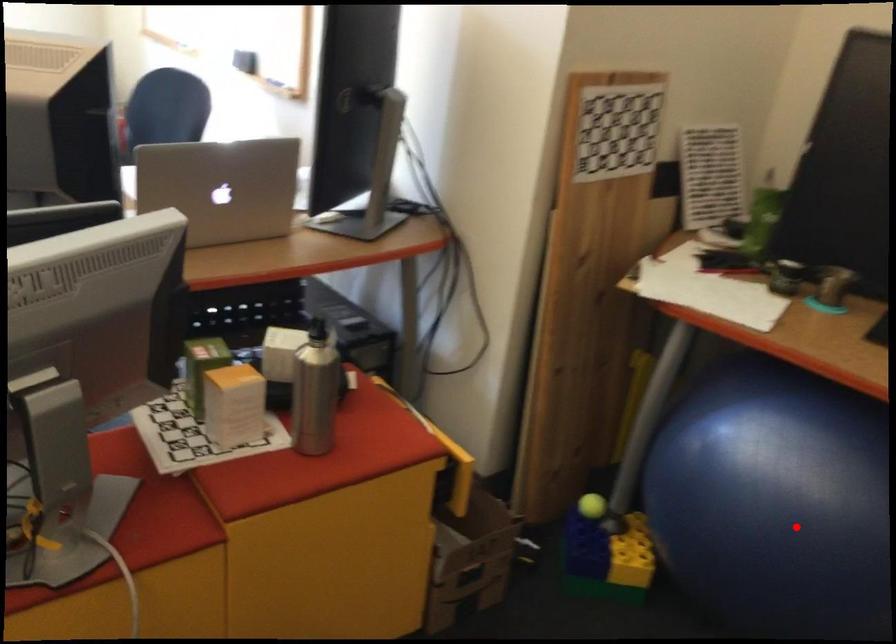
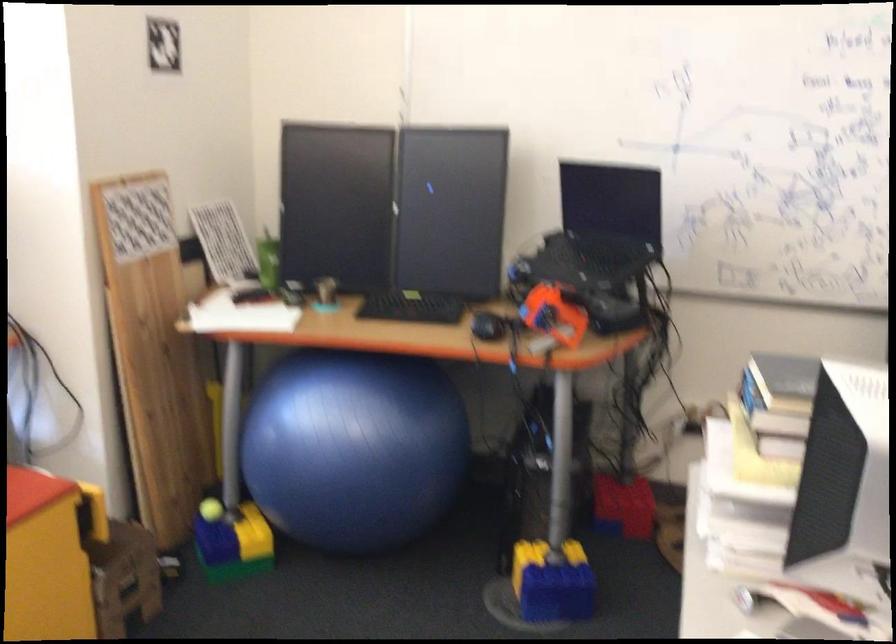
Question: I am providing you with two images of the same scene from different viewpoints. A red point is marked on the first image. Can you still see the location of the red point in image 2?

Choices:
 (A) Yes
 (B) No

Answer: (A)